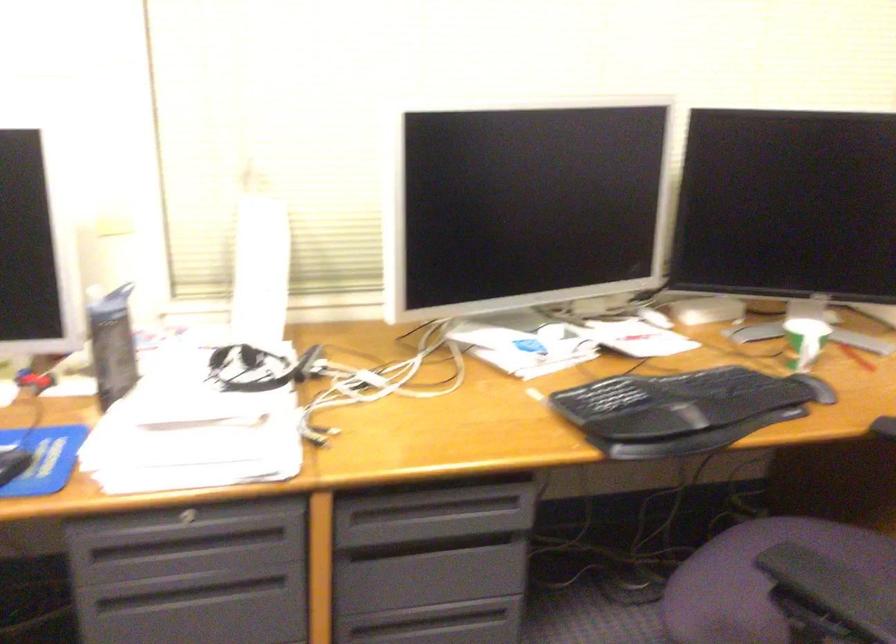
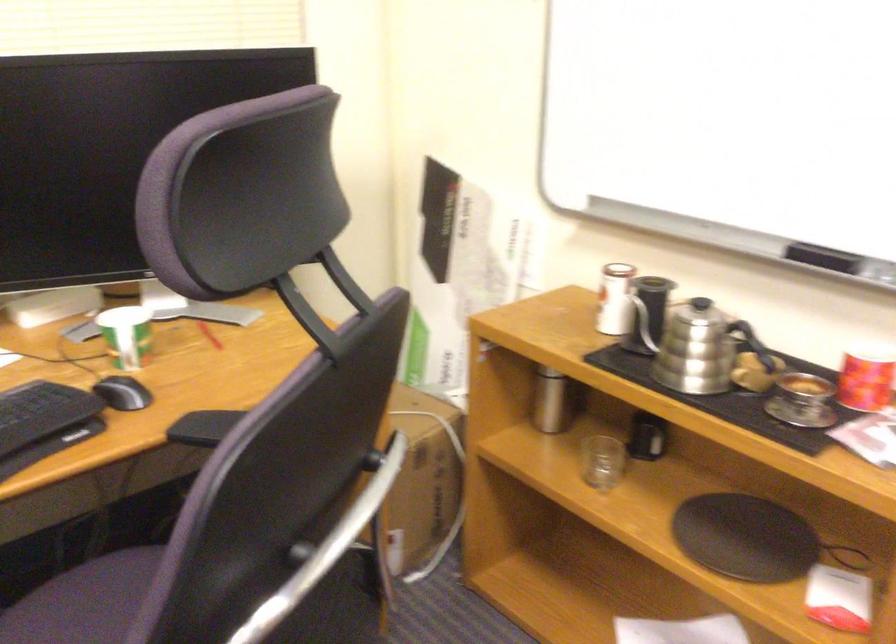
Question: The camera is either moving clockwise (left) or counter-clockwise (right) around the object. The first image is from the beginning of the video and the second image is from the end. Is the camera moving left or right when shooting the video?

Choices:
 (A) Left
 (B) Right

Answer: (A)